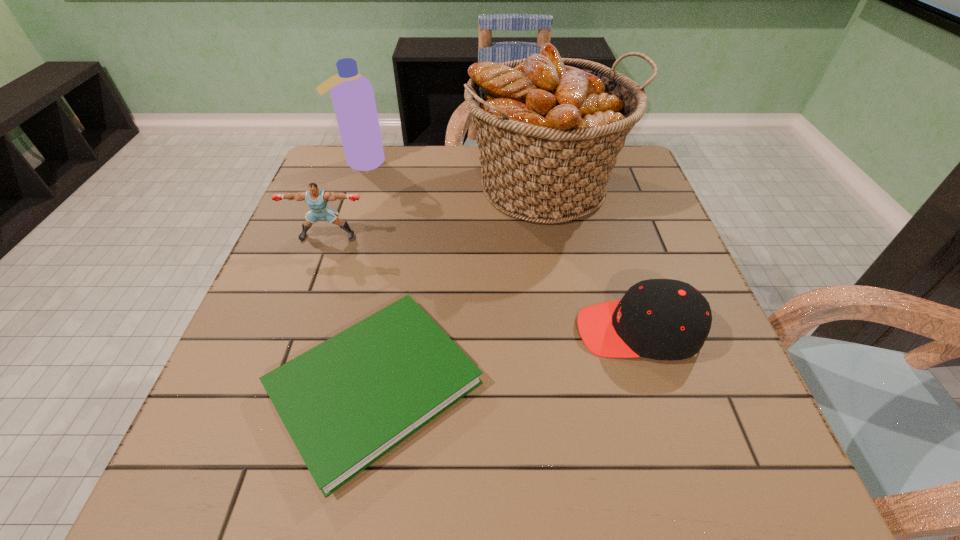
Identify the location of object present at the far left corner. The width and height of the screenshot is (960, 540). (352, 94).

Where is `object positioned at the near left corner`? This screenshot has width=960, height=540. object positioned at the near left corner is located at coordinates 348,401.

Where is `object at the far right corner`? This screenshot has height=540, width=960. object at the far right corner is located at coordinates (549, 129).

In the image, there is a desktop. Where is `free space at the far edge`? The image size is (960, 540). free space at the far edge is located at coordinates (460, 147).

Where is `vacant area at the left edge of the desktop`? The image size is (960, 540). vacant area at the left edge of the desktop is located at coordinates (357, 234).

This screenshot has height=540, width=960. I want to click on vacant space at the right edge, so click(x=623, y=283).

At what (x,y) coordinates should I click in order to perform the action: click on vacant space at the far left corner. Please return your answer as a coordinate pair (x, y). Looking at the image, I should click on (333, 145).

I want to click on vacant space at the near left corner of the desktop, so pos(194,448).

Where is `vacant region at the far right corner of the desktop`? This screenshot has height=540, width=960. vacant region at the far right corner of the desktop is located at coordinates (630, 154).

Where is `vacant space that is in between the fourth tallest object and the shampoo`? The height and width of the screenshot is (540, 960). vacant space that is in between the fourth tallest object and the shampoo is located at coordinates 500,247.